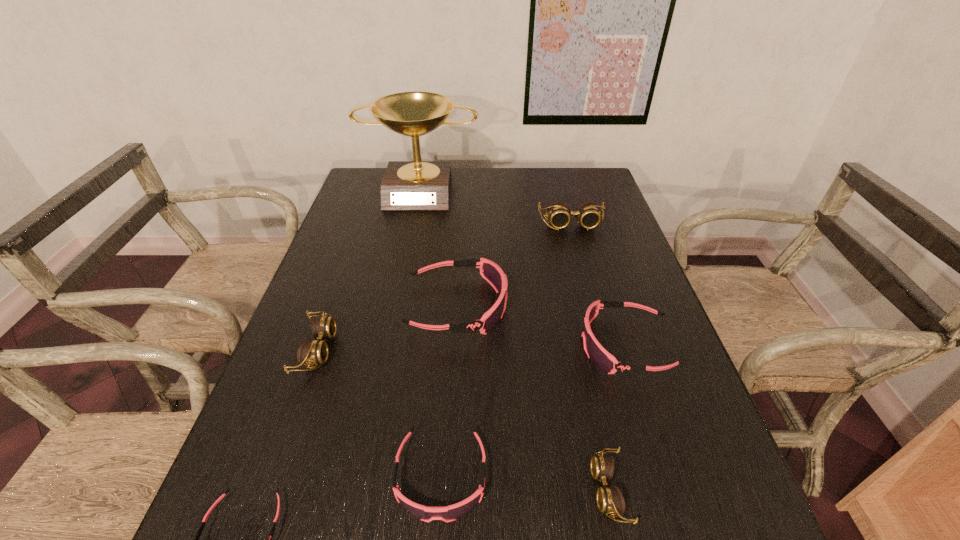
Where is `award`? The height and width of the screenshot is (540, 960). award is located at coordinates (407, 185).

This screenshot has width=960, height=540. I want to click on the farthest object, so click(407, 185).

Locate an element on the screen. The height and width of the screenshot is (540, 960). the biggest pink goggles is located at coordinates (491, 272).

Where is `the biggest brown goggles`? the biggest brown goggles is located at coordinates (587, 214).

Where is `the farthest brown goggles`? the farthest brown goggles is located at coordinates (587, 214).

Identify the location of the rightmost pink goggles. point(595,351).

This screenshot has width=960, height=540. What are the coordinates of `the second biggest brown goggles` in the screenshot? It's located at (310, 352).

You are a GUI agent. You are given a task and a screenshot of the screen. Output one action in this format:
    pyautogui.click(x=<x>, y=<y>)
    Task: Click on the leftmost brown goggles
    Image resolution: width=960 pixels, height=540 pixels.
    Given the screenshot: What is the action you would take?
    pyautogui.click(x=310, y=352)

Image resolution: width=960 pixels, height=540 pixels. In order to click on the third biggest pink goggles in this screenshot , I will do `click(449, 513)`.

Locate an element on the screen. the nearest brown goggles is located at coordinates (610, 500).